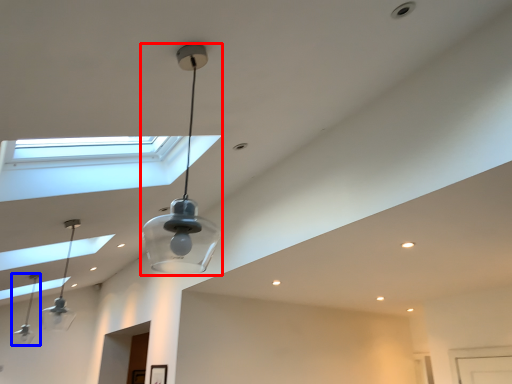
Question: Which point is further to the camera, lamp (highlighted by a red box) or lamp (highlighted by a blue box)?

Choices:
 (A) lamp
 (B) lamp

Answer: (B)